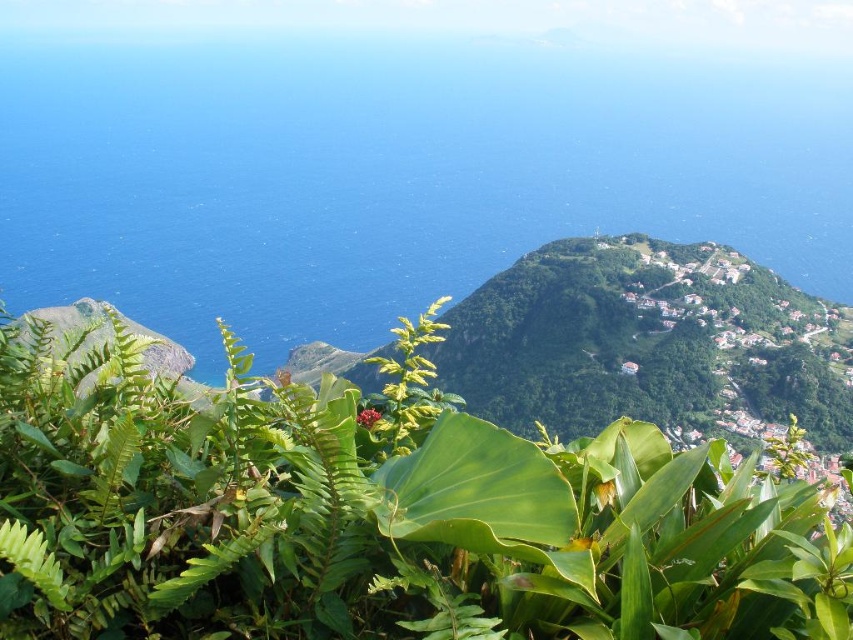
Does green leafy plant at center have a greater width compared to blue liquid water at center?

No.

Who is lower down, green leafy plant at center or blue liquid water at center?

Positioned lower is green leafy plant at center.

I want to click on green leafy plant at center, so click(404, 484).